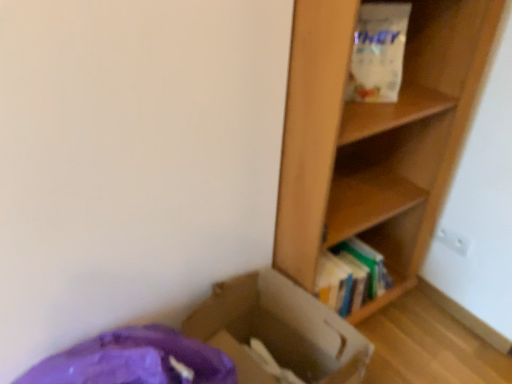
Question: In the image, is white matte paper bag at upper right positioned in front of or behind wooden bookshelf at right?

Choices:
 (A) front
 (B) behind

Answer: (A)

Question: Looking at their shapes, would you say white matte paper bag at upper right is wider or thinner than wooden bookshelf at right?

Choices:
 (A) wide
 (B) thin

Answer: (B)

Question: Estimate the real-world distances between objects in this image. Which object is farther from the wooden shelf at right?

Choices:
 (A) cardboard box at lower left
 (B) white matte paper bag at upper right
 (C) wooden bookshelf at right

Answer: (A)

Question: Which object is positioned farthest from the wooden shelf at right?

Choices:
 (A) white matte paper bag at upper right
 (B) wooden bookshelf at right
 (C) cardboard box at lower left

Answer: (C)